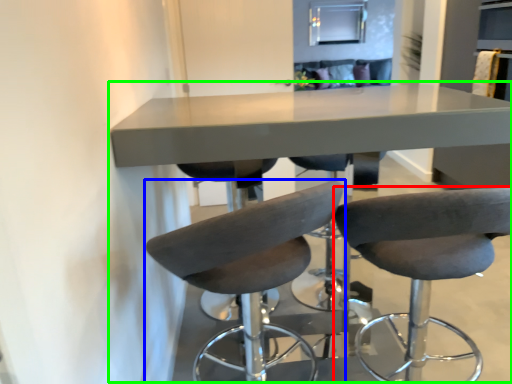
Question: Estimate the real-world distances between objects in this image. Which object is closer to chair (highlighted by a red box), chair (highlighted by a blue box) or table (highlighted by a green box)?

Choices:
 (A) chair
 (B) table

Answer: (A)